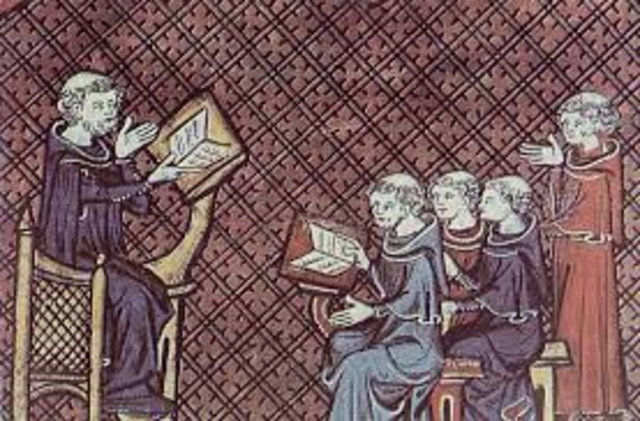
Find the location of a particular element. book is located at coordinates (320, 250), (187, 143).